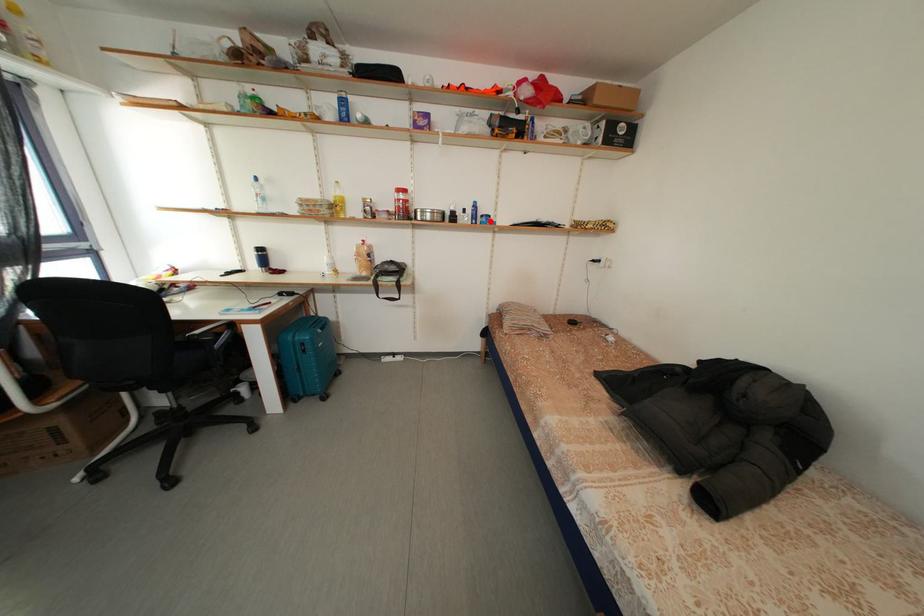
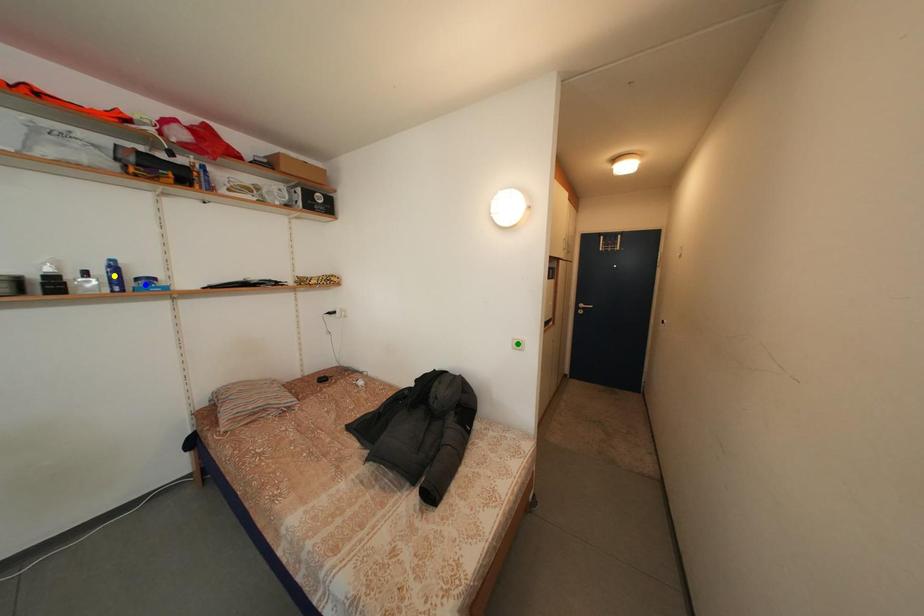
Question: I am providing you with two images of the same scene from different viewpoints. A red point is marked on the first image. You are given multiple points on the second image. Which point in image 2 is actually the same real-world point as the red point in image 1?

Choices:
 (A) blue point
 (B) green point
 (C) yellow point

Answer: (A)